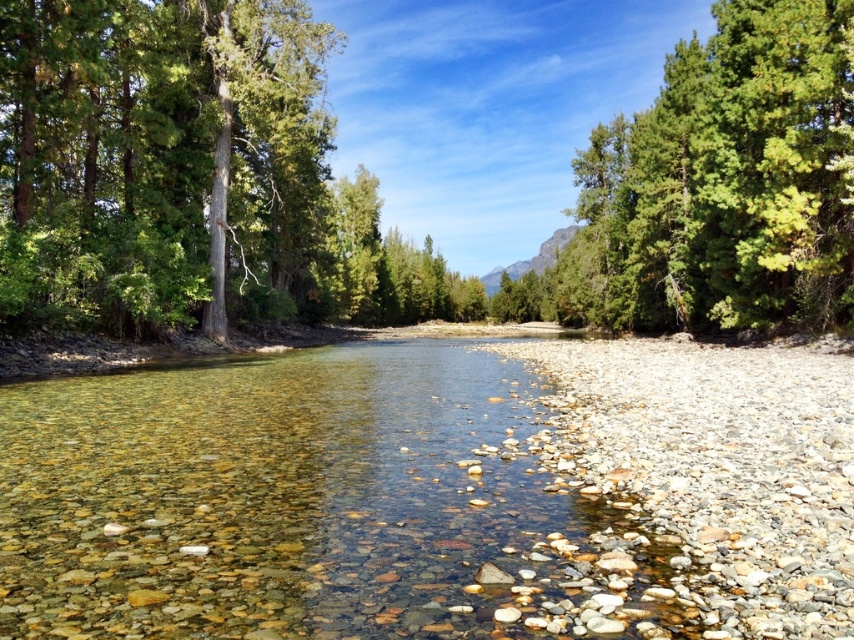
Question: Considering the real-world distances, which object is farthest from the green leafy forest at center?

Choices:
 (A) green leafy tree at upper right
 (B) clear pebbled water at center

Answer: (B)

Question: Among these points, which one is nearest to the camera?

Choices:
 (A) (56, 380)
 (B) (838, 42)

Answer: (A)

Question: Based on their relative distances, which object is nearer to the green leafy forest at center?

Choices:
 (A) green leafy tree at upper right
 (B) clear pebbled water at center

Answer: (A)

Question: Is green leafy forest at center to the left of clear pebbled water at center from the viewer's perspective?

Choices:
 (A) no
 (B) yes

Answer: (A)

Question: From the image, what is the correct spatial relationship of green leafy forest at center in relation to green leafy tree at upper right?

Choices:
 (A) above
 (B) below

Answer: (A)

Question: Is clear pebbled water at center above green leafy tree at upper right?

Choices:
 (A) yes
 (B) no

Answer: (B)